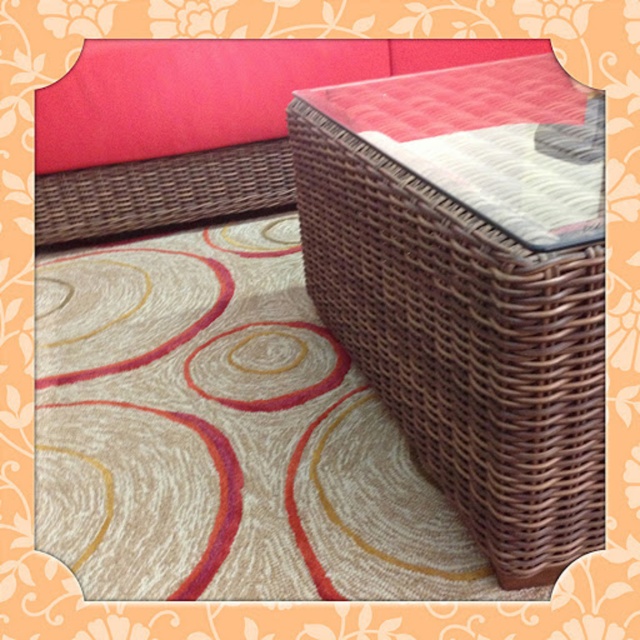
Which is more to the left, brown woven basket at center or brown wicker couch at upper center?

brown wicker couch at upper center

Does brown woven basket at center appear on the left side of brown wicker couch at upper center?

No, brown woven basket at center is not to the left of brown wicker couch at upper center.

You are a GUI agent. You are given a task and a screenshot of the screen. Output one action in this format:
    pyautogui.click(x=<x>, y=<y>)
    Task: Click on the brown woven basket at center
    
    Given the screenshot: What is the action you would take?
    pyautogui.click(x=467, y=296)

Where is `brown woven basket at center`? brown woven basket at center is located at coordinates (467, 296).